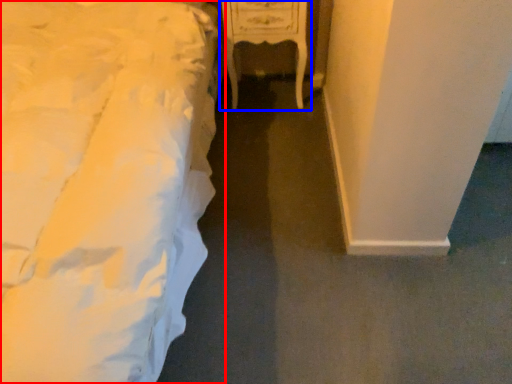
Question: Which object is closer to the camera taking this photo, bed (highlighted by a red box) or furniture (highlighted by a blue box)?

Choices:
 (A) bed
 (B) furniture

Answer: (A)